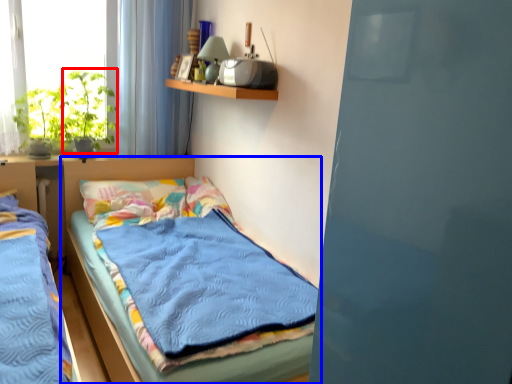
Question: Among these objects, which one is farthest to the camera, plant (highlighted by a red box) or bed (highlighted by a blue box)?

Choices:
 (A) plant
 (B) bed

Answer: (A)